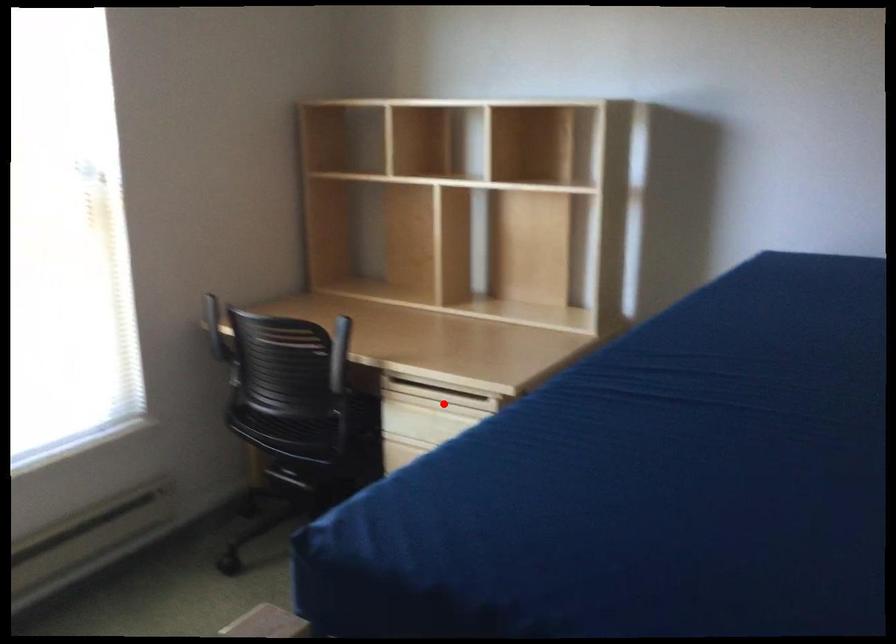
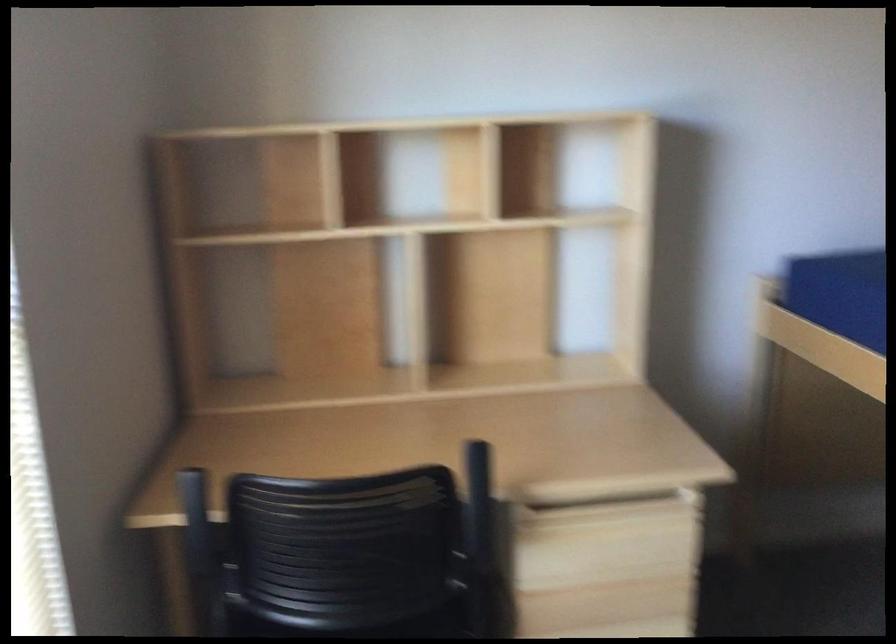
The point at the highlighted location is marked in the first image. Where is the corresponding point in the second image?

(616, 520)